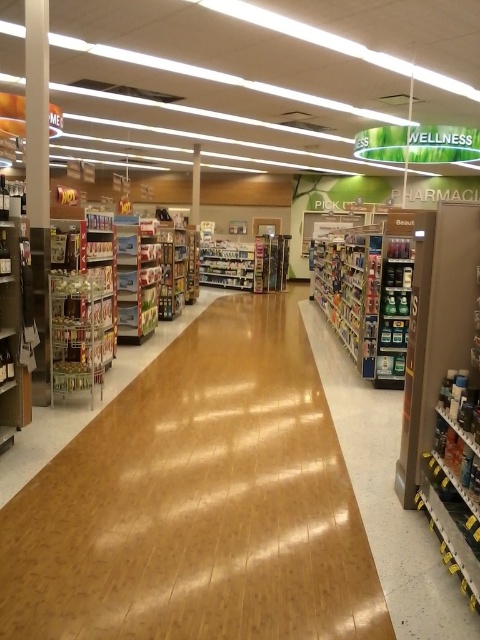
In the scene shown: Is metallic silver shelves at left closer to the viewer compared to matte plastic shelves at left?

Yes, metallic silver shelves at left is closer to the viewer.

Is metallic silver shelves at left above matte plastic shelves at left?

Actually, metallic silver shelves at left is below matte plastic shelves at left.

Who is more forward, (86, 326) or (146, 336)?

Point (86, 326)

Find the location of a particular element. metallic silver shelves at left is located at coordinates (82, 301).

You are a GUI agent. You are given a task and a screenshot of the screen. Output one action in this format:
    pyautogui.click(x=<x>, y=<y>)
    Task: Click on the wooden floor at center
    The image size is (480, 640).
    Given the screenshot: What is the action you would take?
    pyautogui.click(x=199, y=502)

Can you confirm if wooden floor at center is smaller than metallic silver shelves at left?

Yes, wooden floor at center is smaller than metallic silver shelves at left.

Is point (99, 502) farther from camera compared to point (107, 276)?

No, (99, 502) is in front of (107, 276).

Image resolution: width=480 pixels, height=640 pixels. Identify the location of wooden floor at center. (199, 502).

Can you confirm if wooden floor at center is shorter than matte plastic shelves at left?

Yes.

Does wooden floor at center appear on the left side of matte plastic shelves at left?

In fact, wooden floor at center is to the right of matte plastic shelves at left.

Who is more distant from viewer, (240, 518) or (142, 248)?

Point (142, 248)

You are a GUI agent. You are given a task and a screenshot of the screen. Output one action in this format:
    pyautogui.click(x=<x>, y=<y>)
    Task: Click on the wooden floor at center
    The width and height of the screenshot is (480, 640).
    Given the screenshot: What is the action you would take?
    pyautogui.click(x=199, y=502)